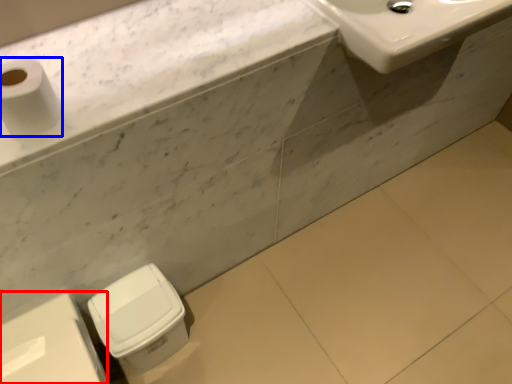
Question: Which object is further to the camera taking this photo, porcelain (highlighted by a red box) or toilet paper (highlighted by a blue box)?

Choices:
 (A) porcelain
 (B) toilet paper

Answer: (A)